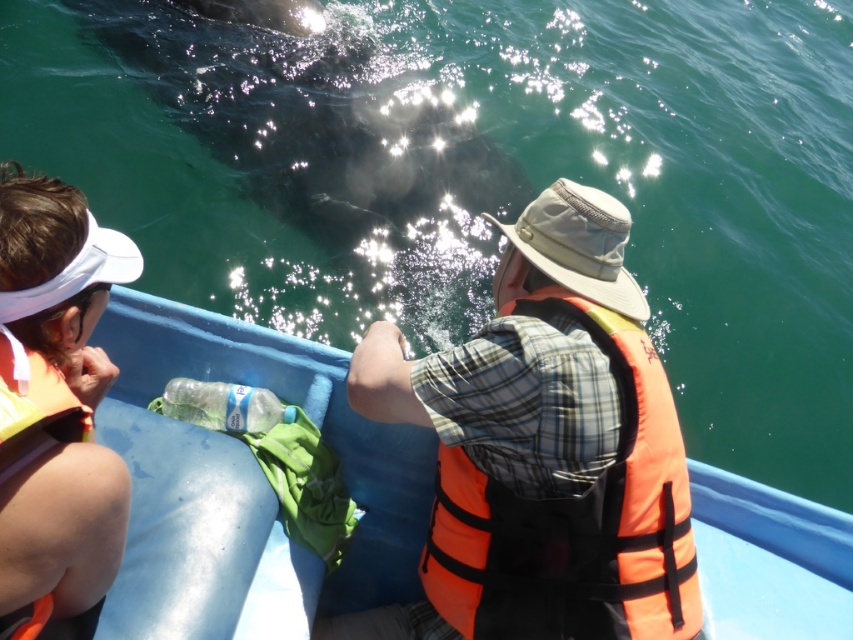
You are a marine biologist on the boat and need to determine which object is taller between the dark gray skin at upper center and the orange life jacket at left. Based on the scene, which one is taller?

The dark gray skin at upper center is taller than the orange life jacket at left according to the description.

You are on a boat and need to grab your life jacket quickly. You see the orange life jacket at center and the orange life vest at left. Which one is closer to the water surface?

The orange life jacket at center is located below orange life vest at left, so the orange life jacket at center is closer to the water surface.

You are a safety inspector checking the spacing between the orange life jacket at center and the orange life vest at left on the boat. The safety regulation requires at least 5 feet between life saving devices. Is the current spacing compliant?

The distance between the orange life jacket at center and the orange life vest at left is 4.70 feet, which is less than the required 5 feet. Therefore, the current spacing does not comply with safety regulations.